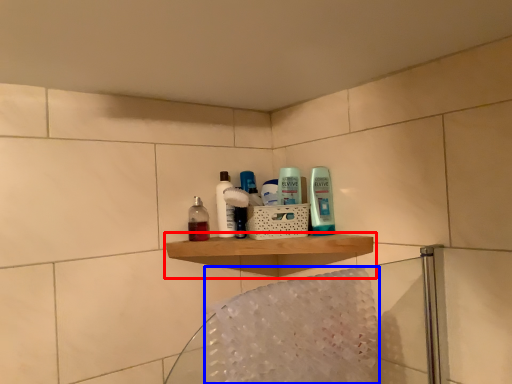
Question: Which object is further to the camera taking this photo, shelf (highlighted by a red box) or bath towel (highlighted by a blue box)?

Choices:
 (A) shelf
 (B) bath towel

Answer: (A)